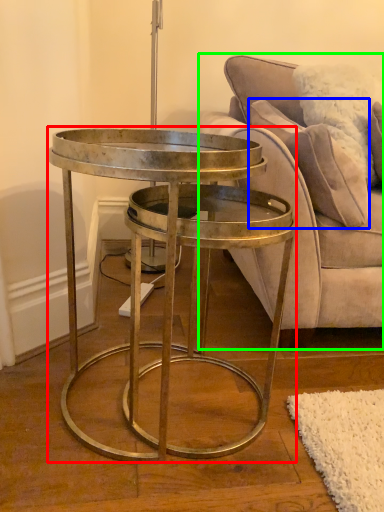
Question: Estimate the real-world distances between objects in this image. Which object is farther from coffee table (highlighted by a red box), pillow (highlighted by a blue box) or studio couch (highlighted by a green box)?

Choices:
 (A) pillow
 (B) studio couch

Answer: (A)